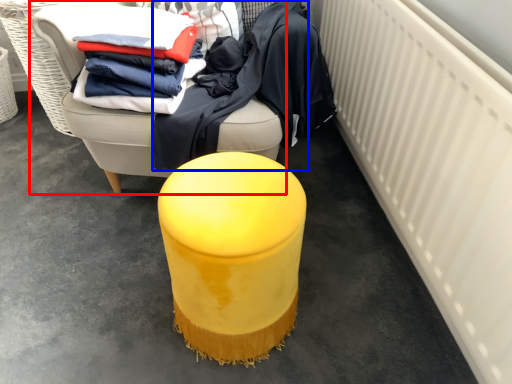
Question: Which of the following is the farthest to the observer, furniture (highlighted by a red box) or clothing (highlighted by a blue box)?

Choices:
 (A) furniture
 (B) clothing

Answer: (B)